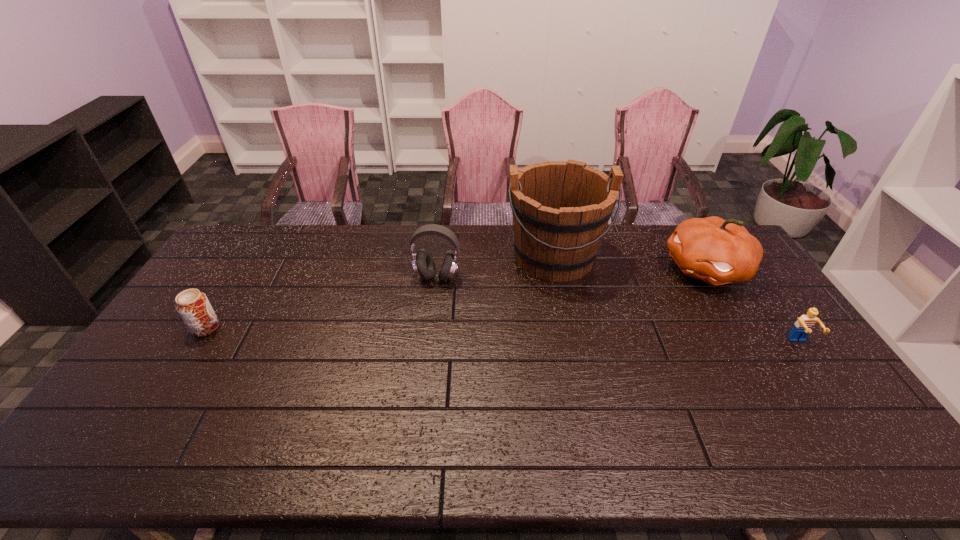
Find the location of `free space on the desktop that is between the leftmost object and the Lego and is positioned on the side of the tallest object with the handle for carrying`. free space on the desktop that is between the leftmost object and the Lego and is positioned on the side of the tallest object with the handle for carrying is located at coordinates (568, 337).

Where is `vacant spot on the desktop that is between the beer can and the Lego and is positioned on the front face of the pumpkin`? vacant spot on the desktop that is between the beer can and the Lego and is positioned on the front face of the pumpkin is located at coordinates (569, 337).

At what (x,y) coordinates should I click in order to perform the action: click on vacant space on the desktop that is between the beer can and the Lego and is positioned on the ear cups of the headset. Please return your answer as a coordinate pair (x, y). This screenshot has height=540, width=960. Looking at the image, I should click on (414, 333).